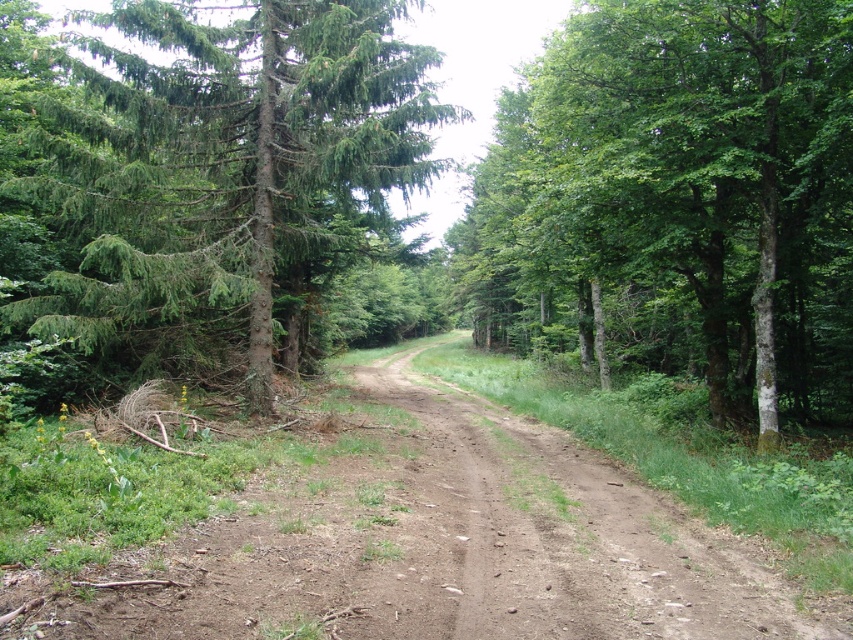
Who is taller, green leafy tree at center or green matte tree at upper left?

With more height is green matte tree at upper left.

Which of these two, green leafy tree at center or green matte tree at upper left, stands shorter?

Standing shorter between the two is green leafy tree at center.

The width and height of the screenshot is (853, 640). I want to click on green leafy tree at center, so click(x=683, y=193).